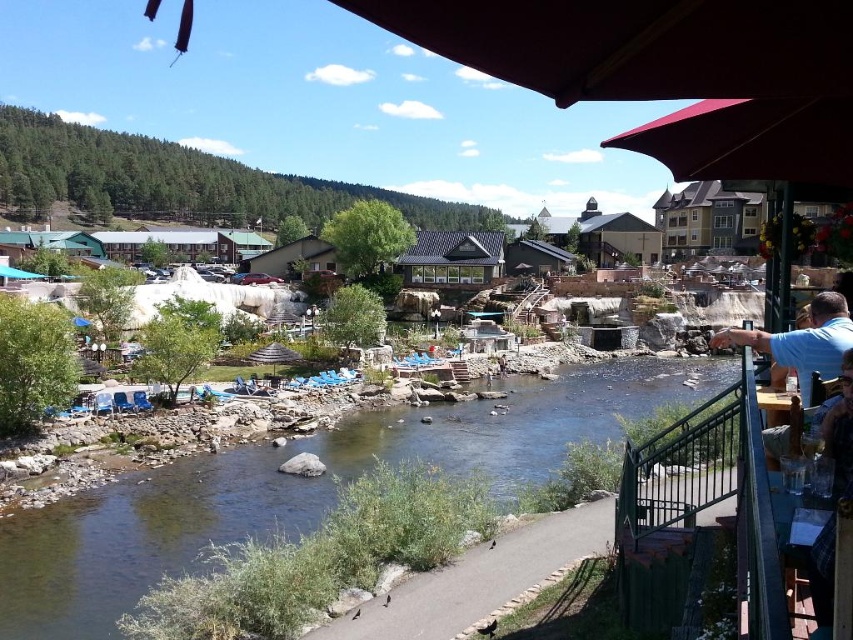
Who is lower down, clear water stream at center or blue shirt at right?

clear water stream at center

Locate an element on the screen. clear water stream at center is located at coordinates (305, 486).

At what (x,y) coordinates should I click in order to perform the action: click on clear water stream at center. Please return your answer as a coordinate pair (x, y). The height and width of the screenshot is (640, 853). Looking at the image, I should click on (305, 486).